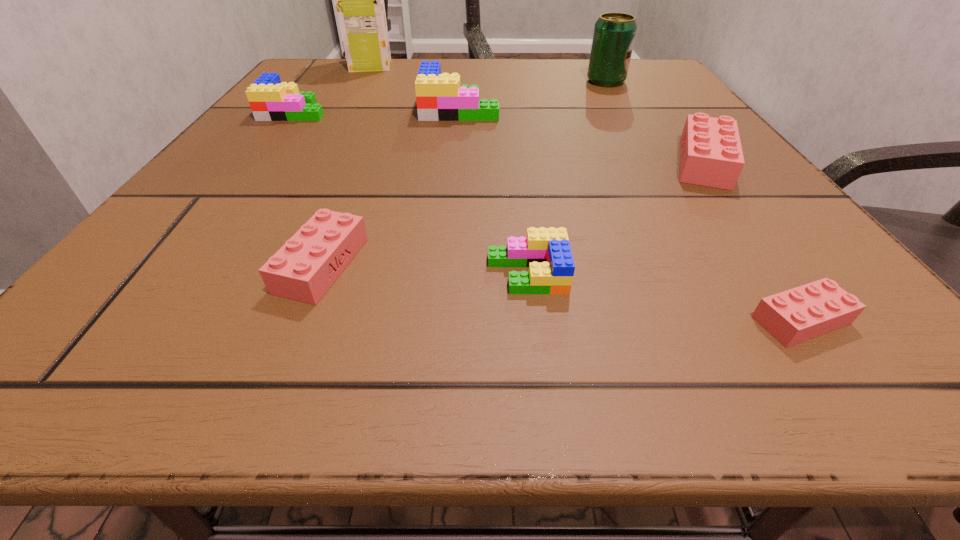
Identify the location of the smallest green Lego. (546, 251).

Locate an element on the screen. The width and height of the screenshot is (960, 540). the leftmost pink Lego is located at coordinates (306, 266).

This screenshot has width=960, height=540. In order to click on the second Lego from left to right in this screenshot , I will do `click(306, 266)`.

Locate an element on the screen. Image resolution: width=960 pixels, height=540 pixels. the shortest object is located at coordinates (802, 313).

The width and height of the screenshot is (960, 540). What are the coordinates of `the smallest pink Lego` in the screenshot? It's located at (802, 313).

At what (x,y) coordinates should I click in order to perform the action: click on vacant area situated 0.210m on the right of the soya milk. Please return your answer as a coordinate pair (x, y). The width and height of the screenshot is (960, 540). Looking at the image, I should click on (480, 65).

Locate an element on the screen. blank space located on the left of the beer can is located at coordinates (437, 82).

Identify the location of vacant region located on the right of the sixth shortest object. (698, 109).

The width and height of the screenshot is (960, 540). What are the coordinates of `free space located on the right of the leftmost green Lego` in the screenshot? It's located at (383, 111).

Locate an element on the screen. The image size is (960, 540). blank space located 0.230m on the back of the farthest pink Lego is located at coordinates (649, 90).